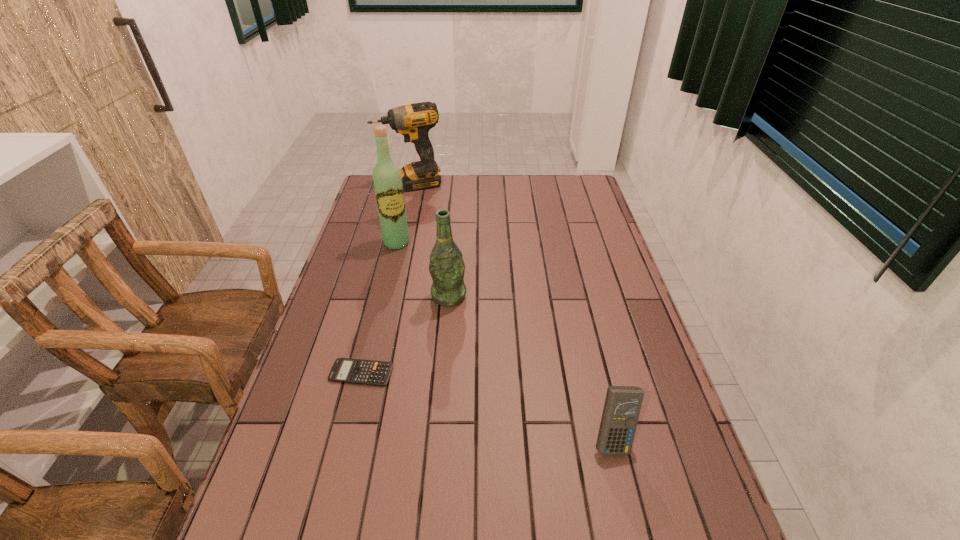
Locate an element on the screen. This screenshot has height=540, width=960. object identified as the closest to the left calculator is located at coordinates (446, 266).

This screenshot has width=960, height=540. Find the location of `free space that satisfies the following two spatial constraints: 1. on the front side of the drill; 2. on the left side of the second object from right to left`. free space that satisfies the following two spatial constraints: 1. on the front side of the drill; 2. on the left side of the second object from right to left is located at coordinates (385, 296).

This screenshot has width=960, height=540. In order to click on vacant space that satisfies the following two spatial constraints: 1. on the back side of the shorter calculator; 2. on the right side of the third farthest object in this screenshot , I will do `click(380, 296)`.

At what (x,y) coordinates should I click in order to perform the action: click on vacant space that satisfies the following two spatial constraints: 1. on the front side of the fourth nearest object; 2. on the left side of the third farthest object. Please return your answer as a coordinate pair (x, y). The width and height of the screenshot is (960, 540). Looking at the image, I should click on (384, 296).